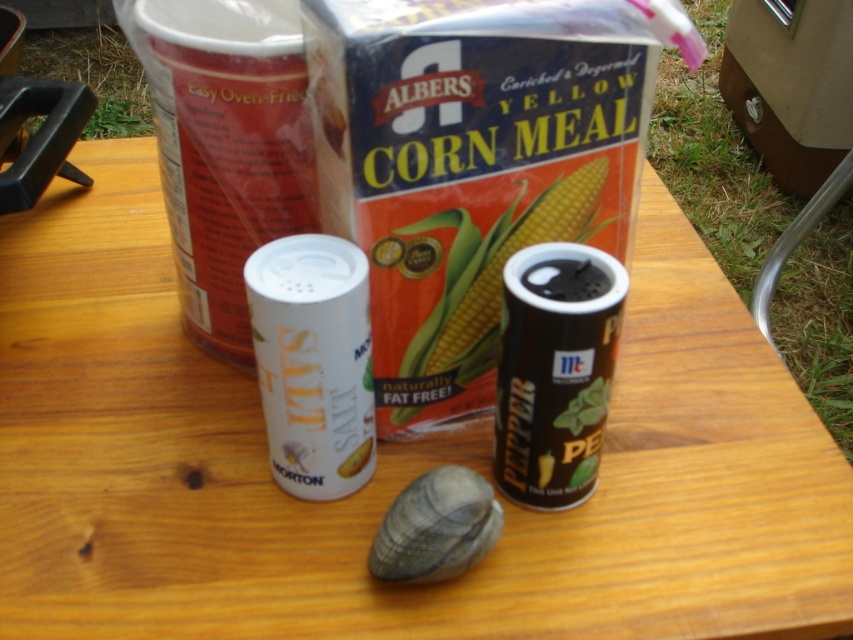
Can you confirm if black matte pepper shaker at center is smaller than white matte salt shaker at center?

Yes, black matte pepper shaker at center is smaller than white matte salt shaker at center.

How much distance is there between black matte pepper shaker at center and white matte salt shaker at center?

8.85 centimeters

This screenshot has width=853, height=640. In order to click on black matte pepper shaker at center in this screenshot , I will do `click(555, 371)`.

In order to click on black matte pepper shaker at center in this screenshot , I will do `click(555, 371)`.

Which of these two, white matte cup at upper left or white matte salt shaker at center, stands taller?

Standing taller between the two is white matte cup at upper left.

Does white matte cup at upper left have a lesser height compared to white matte salt shaker at center?

In fact, white matte cup at upper left may be taller than white matte salt shaker at center.

Is point (244, 74) positioned before point (363, 429)?

Yes, it is.

Where is `white matte cup at upper left`? This screenshot has height=640, width=853. white matte cup at upper left is located at coordinates (225, 145).

Measure the distance between white matte cup at upper left and camera.

white matte cup at upper left is 16.47 inches away from camera.

Is white matte cup at upper left smaller than gray matte shell at center?

Actually, white matte cup at upper left might be larger than gray matte shell at center.

Which is in front, point (299, 17) or point (427, 486)?

Point (427, 486)

Where is `white matte cup at upper left`? The height and width of the screenshot is (640, 853). white matte cup at upper left is located at coordinates (225, 145).